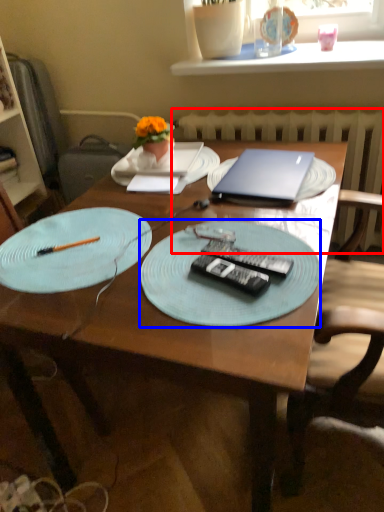
Question: Which point is further to the camera, radiator (highlighted by a red box) or plate (highlighted by a blue box)?

Choices:
 (A) radiator
 (B) plate

Answer: (A)